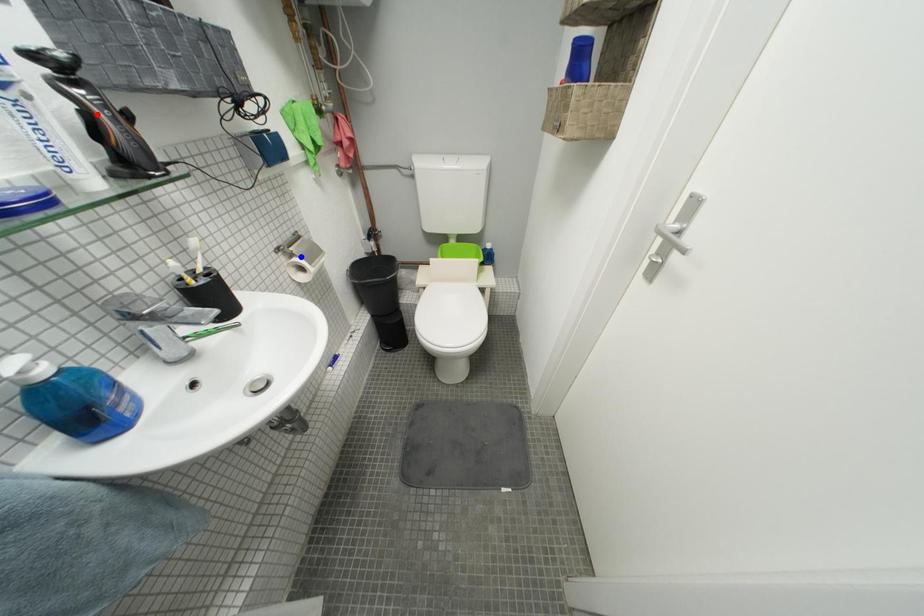
Question: Two points are marked on the image. Which point is closer to the camera?

Choices:
 (A) Blue point is closer.
 (B) Red point is closer.

Answer: (B)